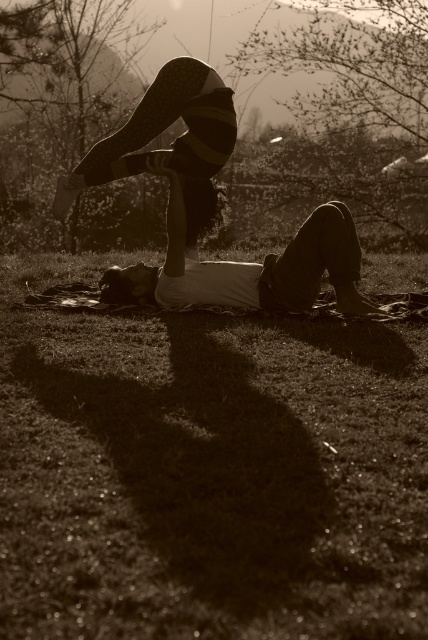
You are taking a photo of the two points in the image. Which point, point (336, 237) or point (222, 92), will appear larger in your photo?

Point (336, 237) is further to the camera than point (222, 92), so it will appear larger in the photo.

Based on the scene described, where is the point with coordinates (208, 472) located?

The point with coordinates (208, 472) is located on the green grass at lower center.

You are standing in the middle of the grassy field and notice the green grass at lower center and the striped leggings at upper center. Which object is shorter?

The green grass at lower center is shorter than the striped leggings at upper center.